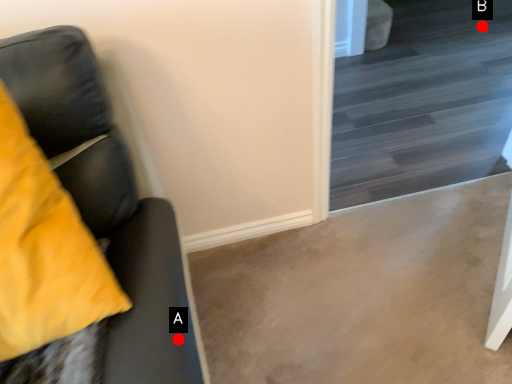
Question: Two points are circled on the image, labeled by A and B beside each circle. Among these points, which one is farthest from the camera?

Choices:
 (A) A is further
 (B) B is further

Answer: (B)